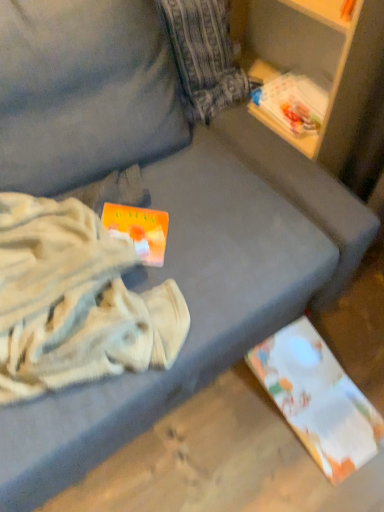
Question: Would you say white cotton blanket at left contains white paper at lower right, acting as the first paperback book starting from the back?

Choices:
 (A) no
 (B) yes

Answer: (A)

Question: Can you confirm if white cotton blanket at left is bigger than white paper at lower right, acting as the first paperback book starting from the back?

Choices:
 (A) no
 (B) yes

Answer: (B)

Question: Does white cotton blanket at left have a lesser width compared to white paper at lower right, which appears as the 2th paperback book when viewed from the front?

Choices:
 (A) no
 (B) yes

Answer: (A)

Question: Is white cotton blanket at left closer to camera compared to white paper at lower right, marked as the first paperback book in a bottom-to-top arrangement?

Choices:
 (A) no
 (B) yes

Answer: (B)

Question: Is white cotton blanket at left taller than white paper at lower right, arranged as the 2th paperback book when viewed from the left?

Choices:
 (A) no
 (B) yes

Answer: (B)

Question: Could you tell me if white cotton blanket at left is facing white paper at lower right, acting as the first paperback book starting from the back?

Choices:
 (A) yes
 (B) no

Answer: (B)

Question: Is orange matte paperback book at center-left, acting as the 2th paperback book starting from the back, aimed at white paper at lower right, marked as the first paperback book in a bottom-to-top arrangement?

Choices:
 (A) no
 (B) yes

Answer: (A)

Question: Is the position of orange matte paperback book at center-left, the 2th paperback book viewed from the right, less distant than that of white paper at lower right, the second paperback book from the top?

Choices:
 (A) yes
 (B) no

Answer: (A)

Question: From a real-world perspective, does orange matte paperback book at center-left, acting as the 1th paperback book starting from the top, stand above white paper at lower right, acting as the first paperback book starting from the back?

Choices:
 (A) yes
 (B) no

Answer: (A)

Question: Does orange matte paperback book at center-left, acting as the 1th paperback book starting from the top, have a larger size compared to white paper at lower right, the first paperback book when ordered from right to left?

Choices:
 (A) yes
 (B) no

Answer: (B)

Question: Does orange matte paperback book at center-left, arranged as the 2th paperback book when ordered from the bottom, lie behind white paper at lower right, marked as the first paperback book in a bottom-to-top arrangement?

Choices:
 (A) no
 (B) yes

Answer: (A)

Question: Can you confirm if orange matte paperback book at center-left, arranged as the 2th paperback book when ordered from the bottom, is positioned to the left of white paper at lower right, marked as the first paperback book in a bottom-to-top arrangement?

Choices:
 (A) no
 (B) yes

Answer: (B)

Question: Is white paper at lower right, acting as the first paperback book starting from the back, shorter than orange matte paperback book at center-left, the 2th paperback book viewed from the right?

Choices:
 (A) yes
 (B) no

Answer: (B)